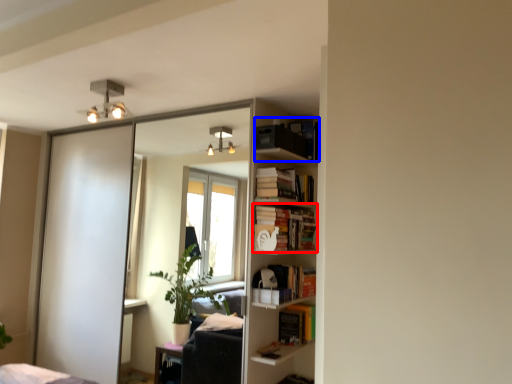
Question: Which of the following is the farthest to the observer, book (highlighted by a red box) or book (highlighted by a blue box)?

Choices:
 (A) book
 (B) book

Answer: (A)